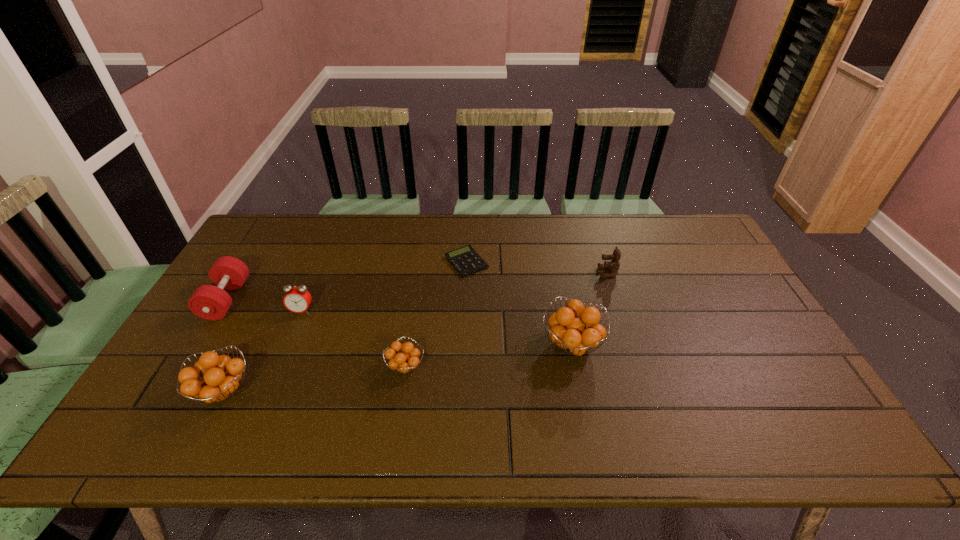
Identify the location of free space between the shortest orange fruit and the second object from right to left. (489, 355).

At what (x,y) coordinates should I click in order to perform the action: click on vacant area that lies between the dumbbell and the fifth object from left to right. Please return your answer as a coordinate pair (x, y). This screenshot has width=960, height=540. Looking at the image, I should click on (347, 281).

I want to click on free space between the fifth object from right to left and the second orange fruit from left to right, so click(354, 339).

What are the coordinates of `free space between the calculator and the second object from right to left` in the screenshot? It's located at (519, 303).

This screenshot has height=540, width=960. In order to click on blank region between the rightmost orange fruit and the alarm clock in this screenshot , I will do `click(437, 328)`.

This screenshot has width=960, height=540. Find the location of `vacant space that's between the leftmost orange fruit and the fourth object from right to left`. vacant space that's between the leftmost orange fruit and the fourth object from right to left is located at coordinates (315, 379).

This screenshot has height=540, width=960. I want to click on object that is the sixth closest to the alarm clock, so click(613, 265).

Locate which object ranks second in proximity to the second object from right to left. Please provide its 2D coordinates. Your answer should be formatted as a tuple, i.e. [(x, y)], where the tuple contains the x and y coordinates of a point satisfying the conditions above.

[(465, 260)]

What are the coordinates of `the closest orange fruit to the second object from right to left` in the screenshot? It's located at (408, 360).

Select which orange fruit appears as the second closest to the dumbbell. Please provide its 2D coordinates. Your answer should be formatted as a tuple, i.e. [(x, y)], where the tuple contains the x and y coordinates of a point satisfying the conditions above.

[(408, 360)]